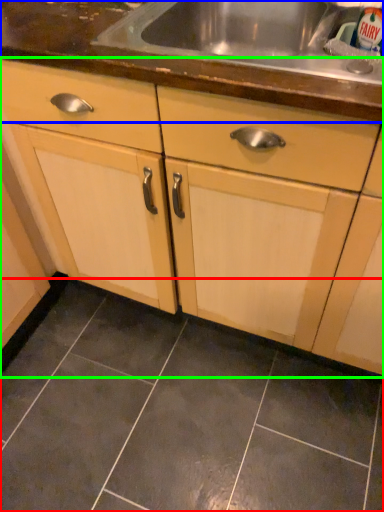
Question: Which is farther away from ceramic tile (highlighted by a red box)? countertop (highlighted by a blue box) or cabinetry (highlighted by a green box)?

Choices:
 (A) countertop
 (B) cabinetry

Answer: (A)